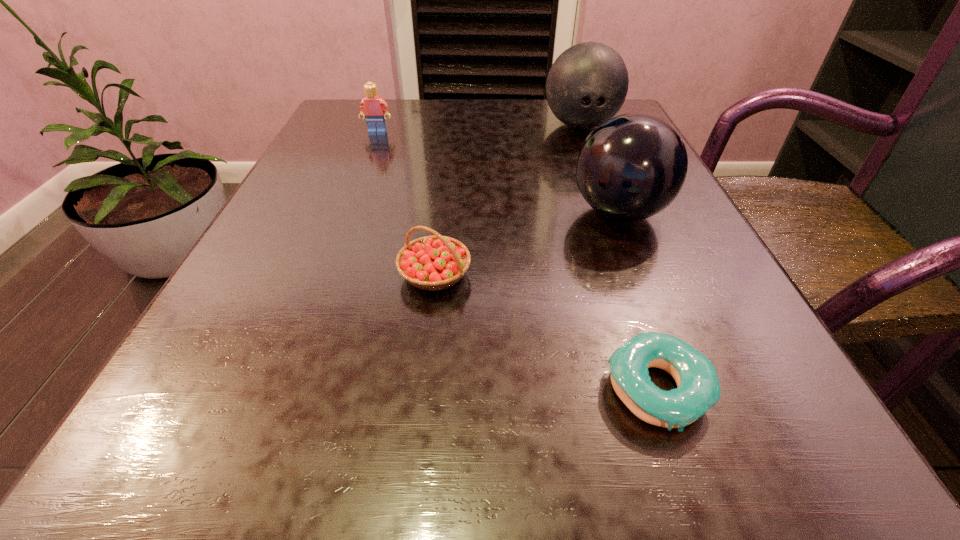
Identify the location of vacant point located on the side of the third nearest object with the finger holes. This screenshot has height=540, width=960. (420, 212).

Where is `free space located on the side of the third nearest object with the finger holes`? The image size is (960, 540). free space located on the side of the third nearest object with the finger holes is located at coordinates (498, 212).

Image resolution: width=960 pixels, height=540 pixels. I want to click on vacant space situated on the front-facing side of the leftmost object, so click(x=345, y=218).

Identify the location of vacant space located 0.050m on the left of the second shortest object. This screenshot has width=960, height=540. (363, 275).

Identify the location of vacant space located 0.190m on the back of the doughnut. This screenshot has width=960, height=540. (609, 247).

This screenshot has height=540, width=960. I want to click on bowling ball located at the far edge, so click(587, 84).

Locate an element on the screen. The height and width of the screenshot is (540, 960). Lego that is at the far edge is located at coordinates [x=372, y=107].

Identify the location of object that is at the near edge. (698, 389).

Identify the location of object at the left edge. (372, 107).

Image resolution: width=960 pixels, height=540 pixels. I want to click on doughnut positioned at the right edge, so click(698, 389).